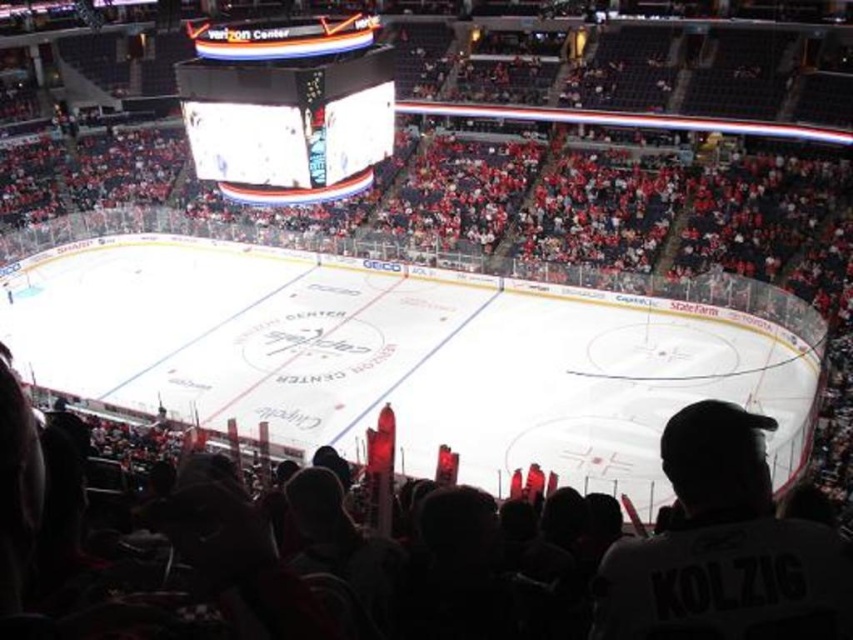
Question: Does white jersey at lower right appear under white led scoreboard at upper center?

Choices:
 (A) no
 (B) yes

Answer: (B)

Question: Which of the following is the closest to the observer?

Choices:
 (A) white jersey at lower right
 (B) white led scoreboard at upper center

Answer: (A)

Question: Which object appears closest to the camera in this image?

Choices:
 (A) white jersey at lower right
 (B) white led scoreboard at upper center

Answer: (A)

Question: Can you confirm if white jersey at lower right is positioned to the right of white led scoreboard at upper center?

Choices:
 (A) no
 (B) yes

Answer: (B)

Question: Is white jersey at lower right to the right of white led scoreboard at upper center from the viewer's perspective?

Choices:
 (A) no
 (B) yes

Answer: (B)